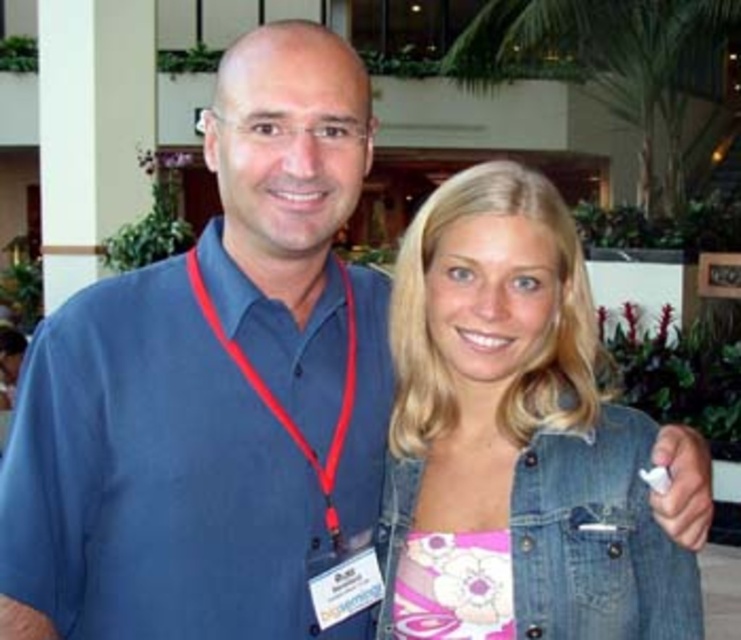
You are standing in the hotel lobby and want to determine which of the two points, point (479, 273) or point (190, 252), is nearer to you. Based on the scene, which point is closer?

Point (479, 273) is closer to the viewer than point (190, 252).

You are a photographer setting up for a group photo. You need to ensure that the denim jacket at right and the red fabric lanyard at center are both visible in the frame. Based on their positions, which object is more likely to be fully visible in the photo?

The denim jacket at right is much taller than the red fabric lanyard at center, so the denim jacket at right is more likely to be fully visible in the photo.